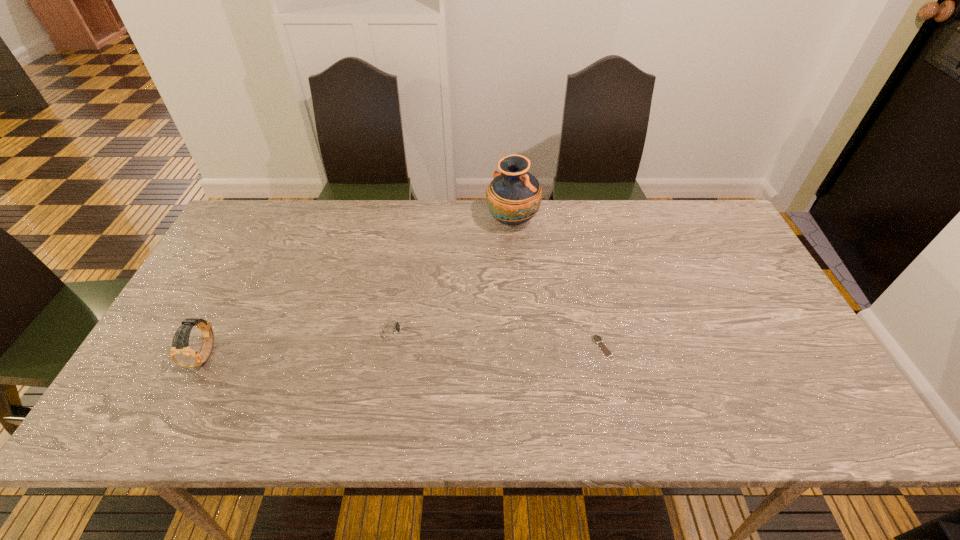
Where is `the second object from right to left`? Image resolution: width=960 pixels, height=540 pixels. the second object from right to left is located at coordinates (514, 196).

At what (x,y) coordinates should I click in order to perform the action: click on pottery. Please return your answer as a coordinate pair (x, y). Looking at the image, I should click on (514, 196).

The width and height of the screenshot is (960, 540). I want to click on the leftmost watch, so click(x=181, y=353).

The width and height of the screenshot is (960, 540). In order to click on the third shortest object in this screenshot , I will do `click(181, 353)`.

Locate an element on the screen. The height and width of the screenshot is (540, 960). the second shortest object is located at coordinates (390, 330).

Locate an element on the screen. The image size is (960, 540). the second shortest watch is located at coordinates (390, 330).

This screenshot has width=960, height=540. In order to click on the shortest watch in this screenshot , I will do `click(596, 338)`.

Find the location of `the shortest object`. the shortest object is located at coordinates (596, 338).

At what (x,y) coordinates should I click in order to perform the action: click on free space located on the left of the third object from left to right. Please return your answer as a coordinate pair (x, y). The height and width of the screenshot is (540, 960). Looking at the image, I should click on (430, 221).

This screenshot has width=960, height=540. Identify the location of free space located on the face of the leftmost watch. (172, 422).